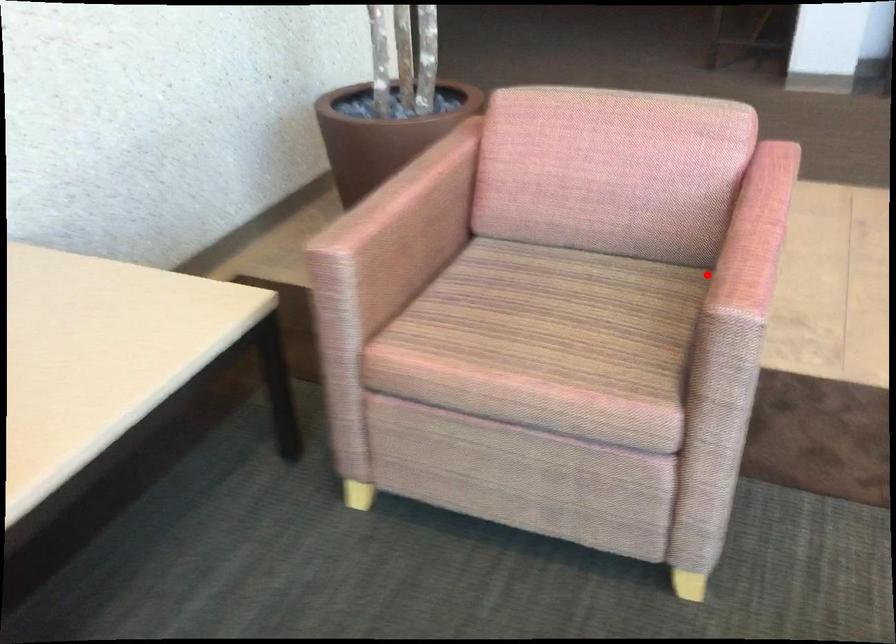
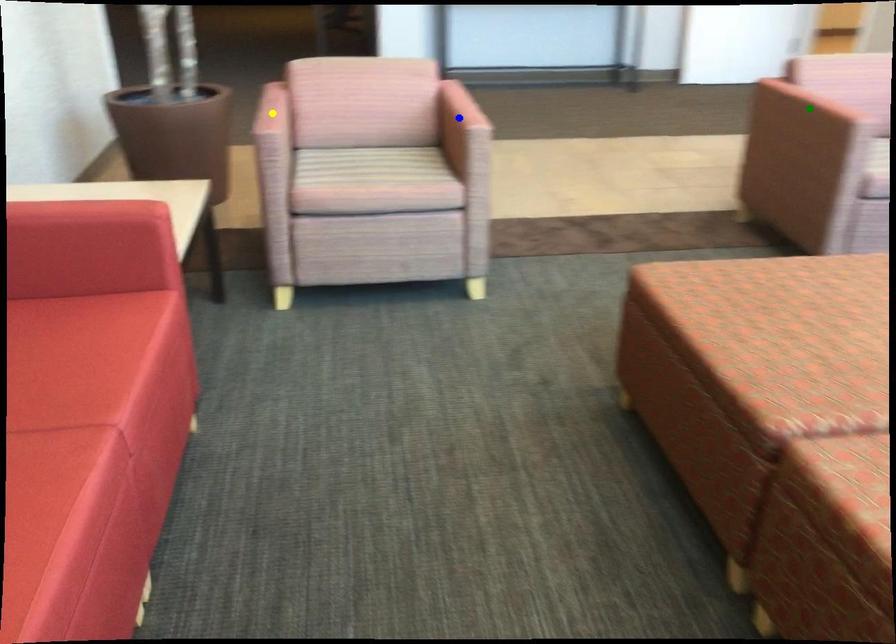
Question: I am providing you with two images of the same scene from different viewpoints. A red point is marked on the first image. You are given multiple points on the second image. In image 2, which mark is for the same physical point as the one in image 1?

Choices:
 (A) blue point
 (B) green point
 (C) yellow point

Answer: (A)